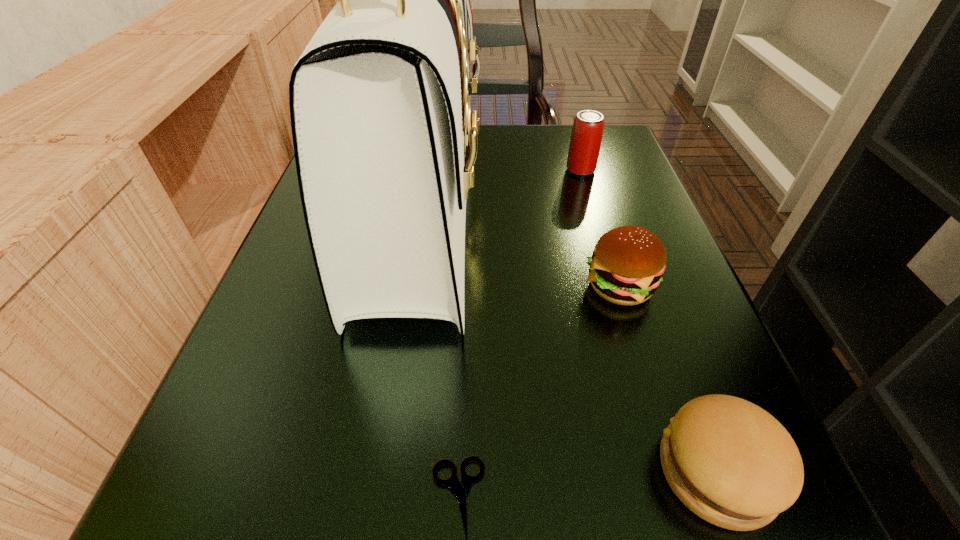
In the image, there is a desktop. At what (x,y) coordinates should I click in order to perform the action: click on vacant space at the right edge. Please return your answer as a coordinate pair (x, y). The image size is (960, 540). Looking at the image, I should click on (607, 185).

This screenshot has width=960, height=540. In the image, there is a desktop. What are the coordinates of `vacant space at the far right corner` in the screenshot? It's located at [x=616, y=168].

In order to click on free space between the fourth shortest object and the third tallest object in this screenshot , I will do `click(600, 228)`.

Image resolution: width=960 pixels, height=540 pixels. What are the coordinates of `free spot between the beer can and the tallest object` in the screenshot? It's located at (500, 191).

You are a GUI agent. You are given a task and a screenshot of the screen. Output one action in this format:
    pyautogui.click(x=<x>, y=<y>)
    Task: Click on the vacant space that's between the tallest object and the fourth tallest object
    The image size is (960, 540).
    Given the screenshot: What is the action you would take?
    [x=568, y=341]

You are a GUI agent. You are given a task and a screenshot of the screen. Output one action in this format:
    pyautogui.click(x=<x>, y=<y>)
    Task: Click on the free area in between the satchel and the beer can
    This screenshot has width=960, height=540.
    Given the screenshot: What is the action you would take?
    pyautogui.click(x=500, y=191)

Locate an element on the screen. This screenshot has width=960, height=540. empty location between the third tallest object and the beer can is located at coordinates (600, 228).

Where is `unoccupied position between the taller hamburger and the beer can`? Image resolution: width=960 pixels, height=540 pixels. unoccupied position between the taller hamburger and the beer can is located at coordinates (600, 228).

Where is `blank region between the shorter hamburger and the farther hamburger`? blank region between the shorter hamburger and the farther hamburger is located at coordinates (668, 379).

Find the location of `the second closest object relative to the fourth shortest object`. the second closest object relative to the fourth shortest object is located at coordinates (627, 264).